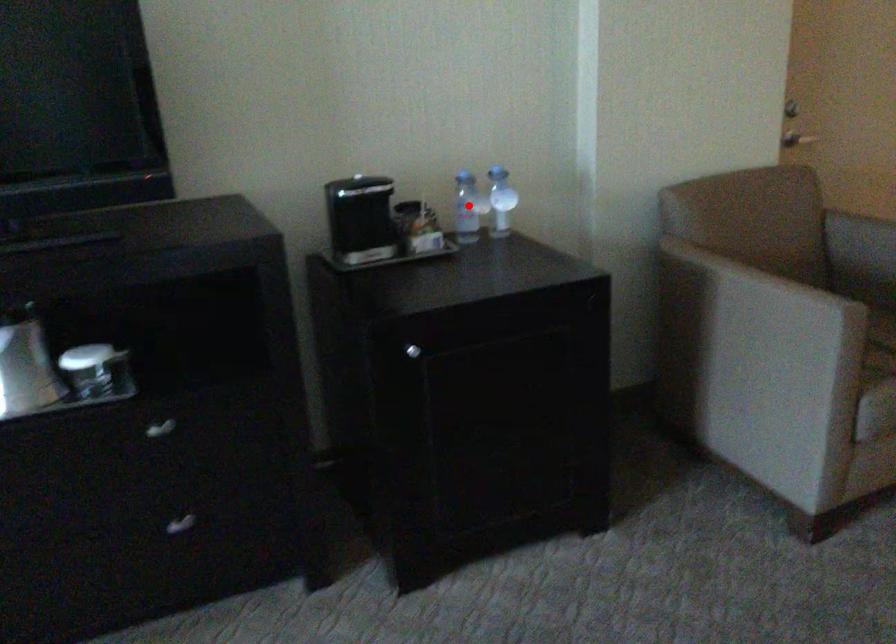
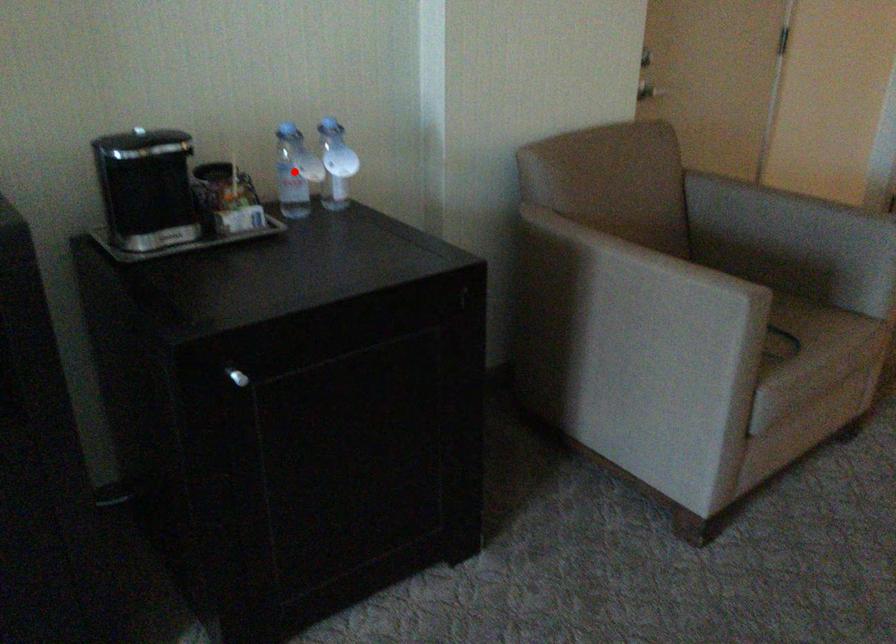
I am providing you with two images of the same scene from different viewpoints. A red point is marked on the first image and another point is marked on the second image. Is the red point in image1 aligned with the point shown in image2?

Yes